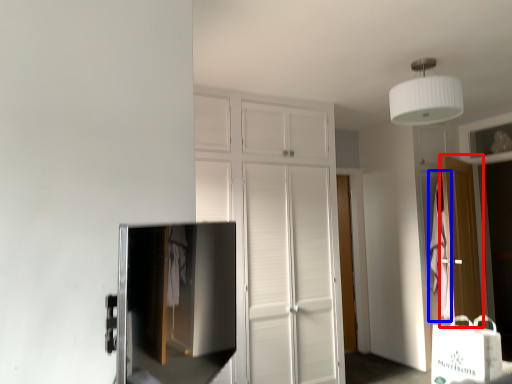
Question: Which object is further to the camera taking this photo, door (highlighted by a red box) or blanket (highlighted by a blue box)?

Choices:
 (A) door
 (B) blanket

Answer: (B)